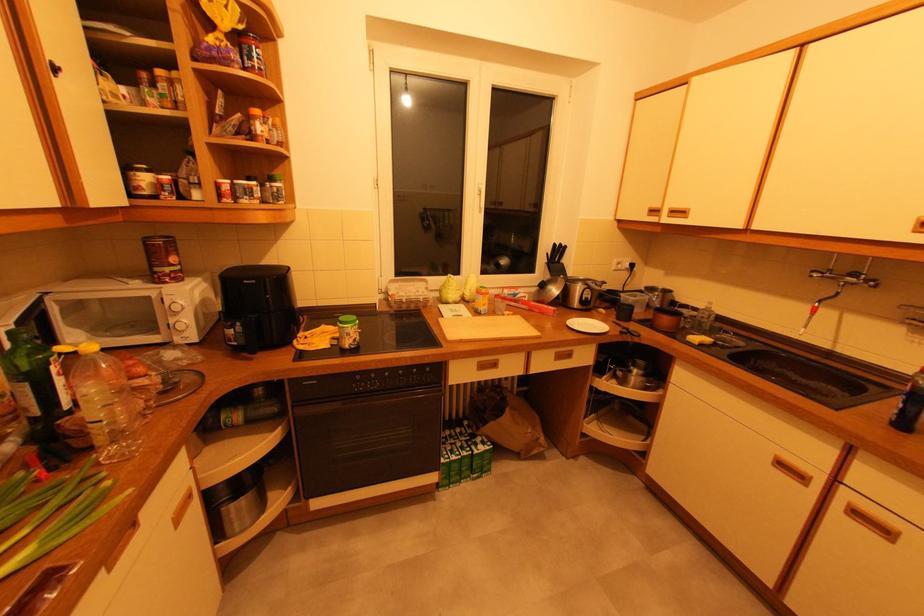
The height and width of the screenshot is (616, 924). In order to click on pot lid handle in this screenshot , I will do `click(628, 365)`.